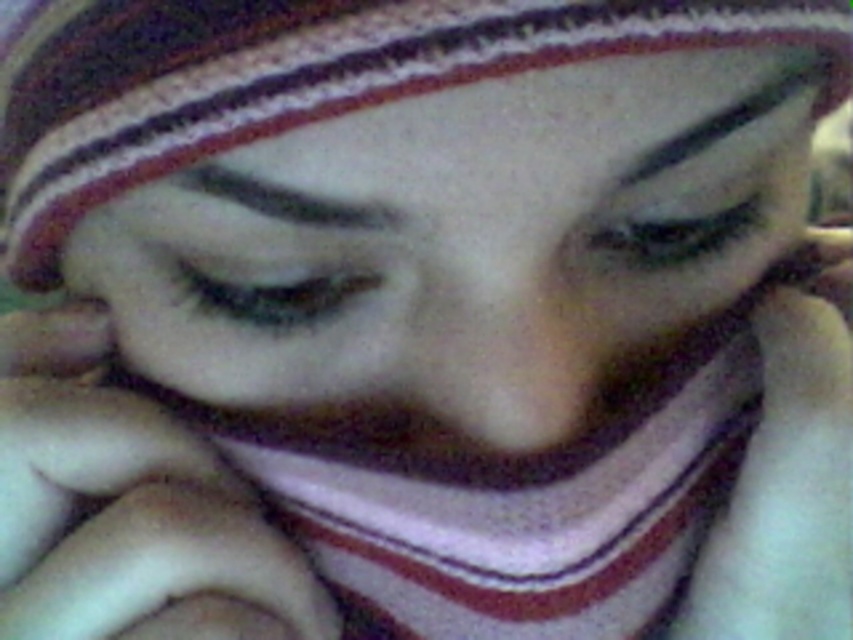
Question: Considering the relative positions of white knitted hat at upper center and white soft hand at center in the image provided, where is white knitted hat at upper center located with respect to white soft hand at center?

Choices:
 (A) below
 (B) above

Answer: (B)

Question: Is matte white face at center smaller than white soft fabric at lower right?

Choices:
 (A) no
 (B) yes

Answer: (A)

Question: Does white knitted hat at upper center have a greater width compared to white soft hand at center?

Choices:
 (A) no
 (B) yes

Answer: (B)

Question: Estimate the real-world distances between objects in this image. Which object is farther from the white soft hand at center?

Choices:
 (A) matte white face at center
 (B) white knitted hat at upper center
 (C) white soft fabric at lower right

Answer: (C)

Question: Which object is farther from the camera taking this photo?

Choices:
 (A) white knitted hat at upper center
 (B) matte white face at center
 (C) white soft hand at center

Answer: (C)

Question: Among these objects, which one is farthest from the camera?

Choices:
 (A) white knitted hat at upper center
 (B) matte white face at center
 (C) white soft fabric at lower right

Answer: (C)